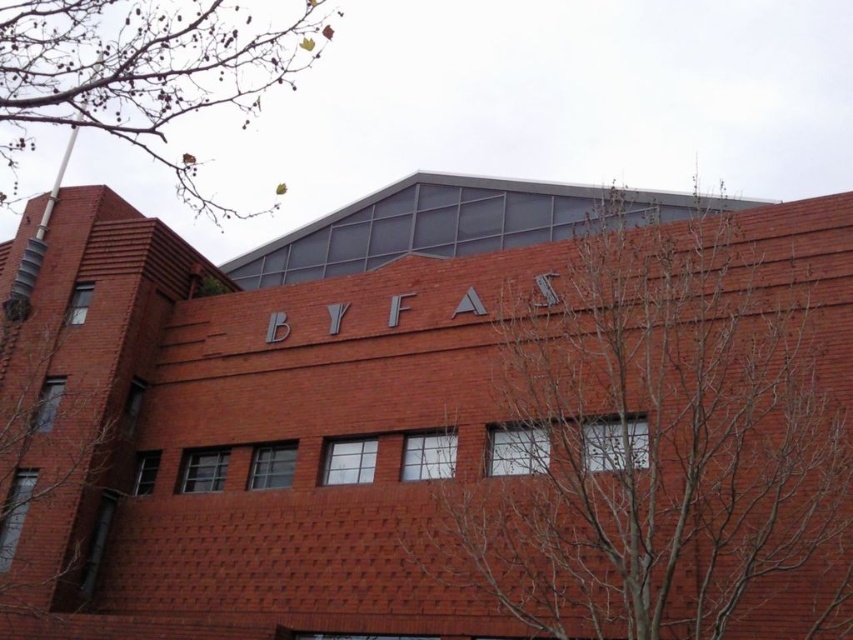
You are an arborist inspecting the trees in front of the brick building with the word BYFA. You notice two sets of bare branches in the foreground. Which set, the bare branches at center or the bare branches at left, has a larger size?

The bare branches at center is bigger than the bare branches at left, so the set at the center has a larger size.

You are standing in front of the brick building and notice two sets of bare branches in the foreground. Which one, the bare branches at center or the bare branches at left, is taller?

The bare branches at center is taller than the bare branches at left.